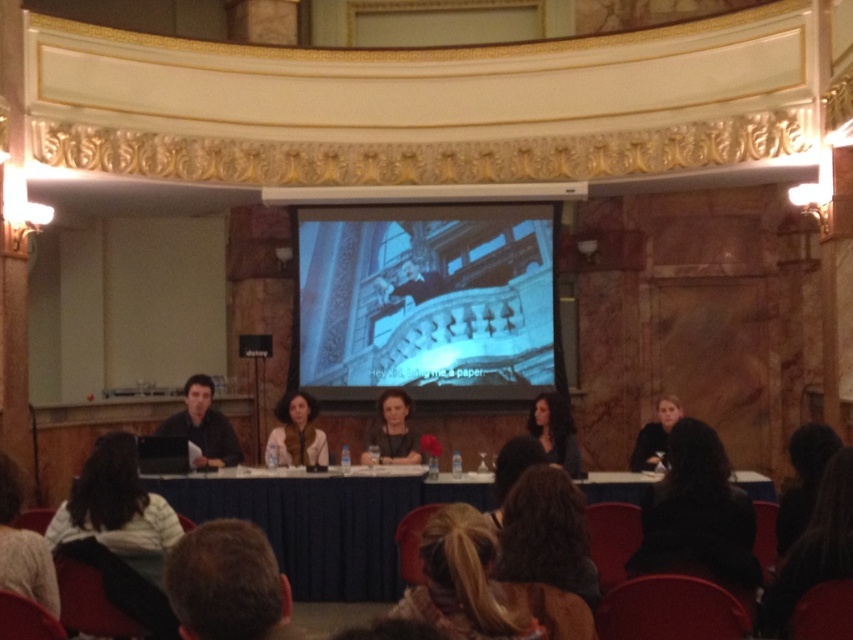
Question: Which point is closer to the camera?

Choices:
 (A) (511, 576)
 (B) (248, 611)

Answer: (B)

Question: Can you confirm if brown hair at lower left is positioned above dark blue shirt at left?

Choices:
 (A) no
 (B) yes

Answer: (A)

Question: Is blue fabric table at center behind matte black hair at center?

Choices:
 (A) yes
 (B) no

Answer: (B)

Question: Is the position of matte black screen at center more distant than that of dark brown hair at lower right?

Choices:
 (A) no
 (B) yes

Answer: (B)

Question: Which point appears closest to the camera in this image?

Choices:
 (A) (637, 432)
 (B) (206, 556)
 (C) (428, 564)
 (D) (223, 500)

Answer: (B)

Question: Which point is closer to the camera?

Choices:
 (A) pyautogui.click(x=305, y=376)
 (B) pyautogui.click(x=444, y=525)
 (C) pyautogui.click(x=207, y=420)

Answer: (B)